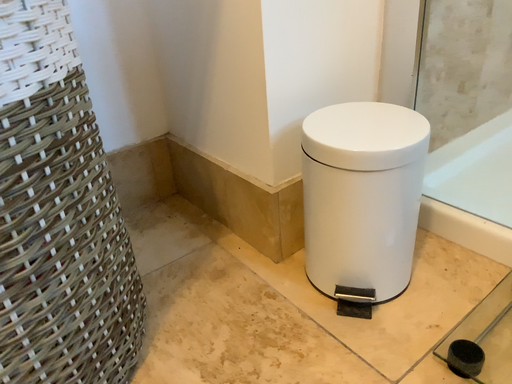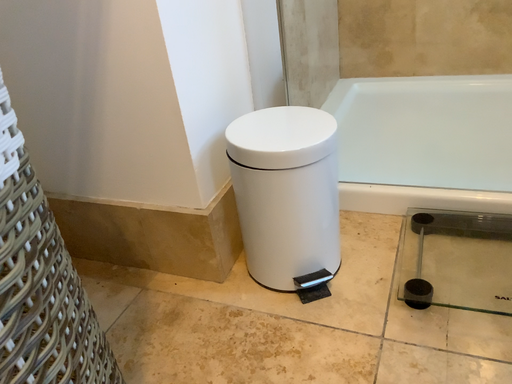
Question: Which way did the camera rotate in the video?

Choices:
 (A) rotated left
 (B) rotated right

Answer: (B)